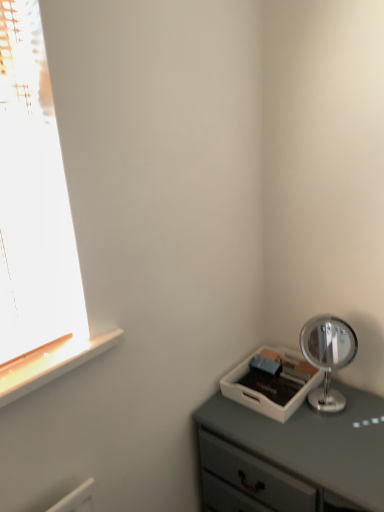
Where is `free space in front of polished silver mirror at right`? This screenshot has width=384, height=512. free space in front of polished silver mirror at right is located at coordinates (336, 439).